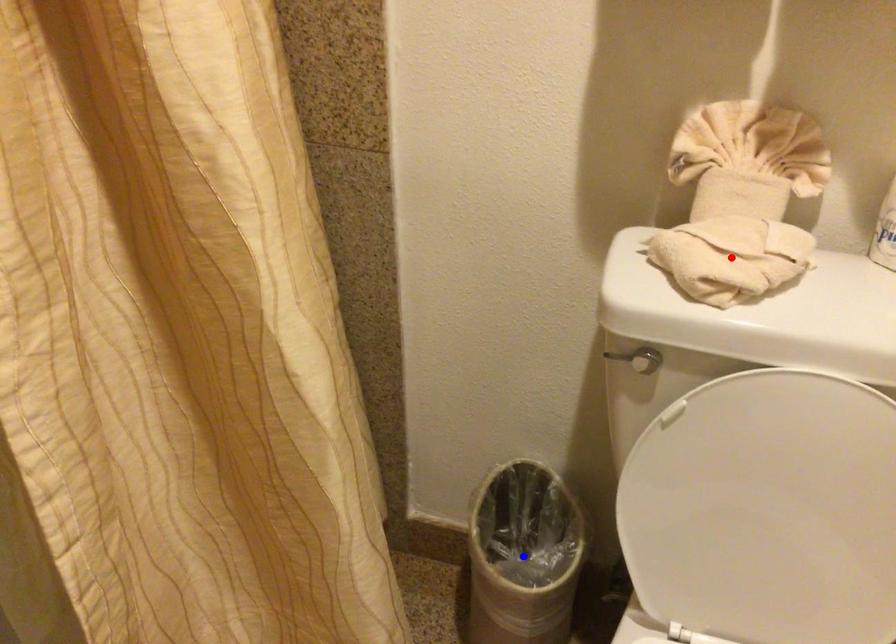
Question: In the image, two points are highlighted. Which point is nearer to the camera? Reply with the corresponding letter.

Choices:
 (A) blue point
 (B) red point

Answer: (B)